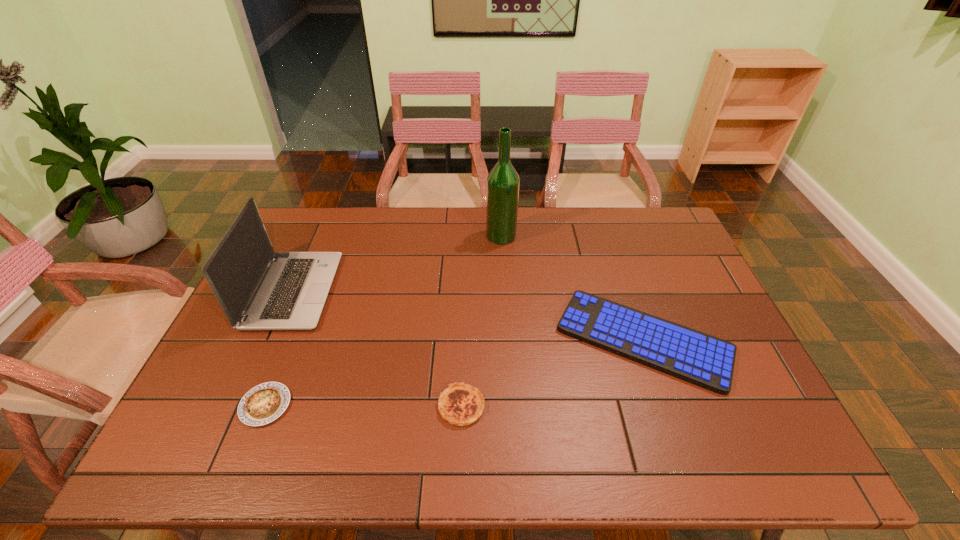
Locate an element on the screen. The height and width of the screenshot is (540, 960). the second object from right to left is located at coordinates (503, 182).

Where is `the tallest object`? The image size is (960, 540). the tallest object is located at coordinates (503, 182).

This screenshot has width=960, height=540. In order to click on laptop computer in this screenshot , I will do `click(258, 289)`.

Locate an element on the screen. computer keyboard is located at coordinates (704, 360).

Where is `the right quiche`? the right quiche is located at coordinates (460, 404).

The width and height of the screenshot is (960, 540). Find the location of `the left quiche`. the left quiche is located at coordinates (264, 403).

This screenshot has height=540, width=960. Identify the location of vacant space located 0.050m on the back of the second object from right to left. (500, 219).

Locate an element on the screen. This screenshot has width=960, height=540. vacant area situated 0.370m on the screen of the laptop computer is located at coordinates (454, 291).

Image resolution: width=960 pixels, height=540 pixels. I want to click on free spot located 0.070m on the left of the rightmost object, so click(x=533, y=340).

Locate an element on the screen. This screenshot has width=960, height=540. free space located 0.240m on the left of the third object from right to left is located at coordinates (337, 406).